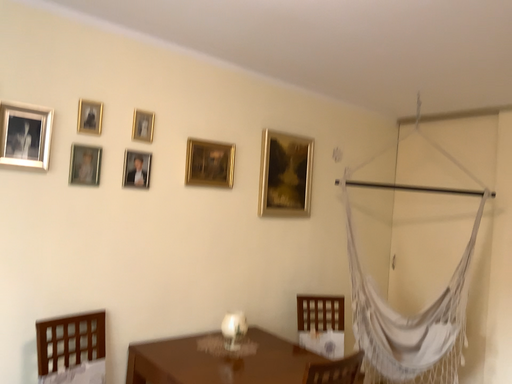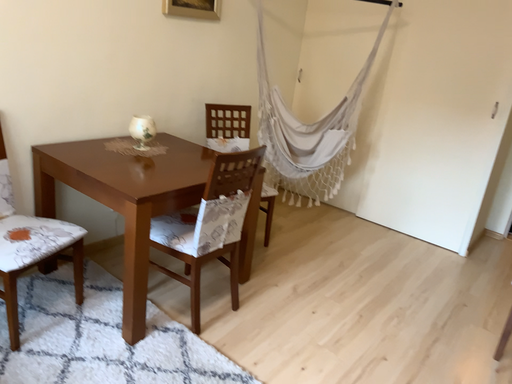
Question: How did the camera likely rotate when shooting the video?

Choices:
 (A) rotated upward
 (B) rotated downward

Answer: (B)